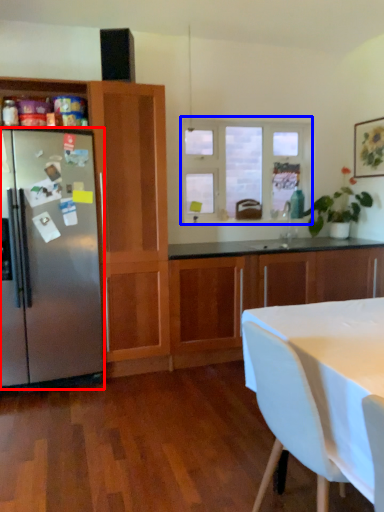
Question: Which object is further to the camera taking this photo, refrigerator (highlighted by a red box) or window (highlighted by a blue box)?

Choices:
 (A) refrigerator
 (B) window

Answer: (B)